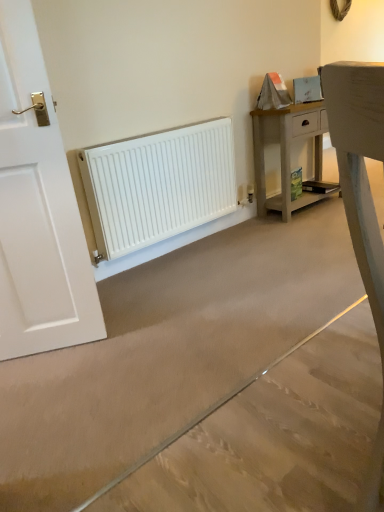
Question: Can you confirm if white matte radiator at lower left is positioned to the right of white matte radiator at center?

Choices:
 (A) yes
 (B) no

Answer: (B)

Question: Can we say white matte radiator at lower left lies outside white matte radiator at center?

Choices:
 (A) no
 (B) yes

Answer: (B)

Question: Can you confirm if white matte radiator at lower left is wider than white matte radiator at center?

Choices:
 (A) no
 (B) yes

Answer: (A)

Question: Is the position of white matte radiator at lower left more distant than that of white matte radiator at center?

Choices:
 (A) no
 (B) yes

Answer: (B)

Question: Considering the relative sizes of white matte radiator at lower left and white matte radiator at center in the image provided, is white matte radiator at lower left shorter than white matte radiator at center?

Choices:
 (A) yes
 (B) no

Answer: (B)

Question: From a real-world perspective, relative to white matte radiator at lower left, is light wood nightstand at upper right vertically above or below?

Choices:
 (A) above
 (B) below

Answer: (B)

Question: From the image's perspective, is light wood nightstand at upper right positioned above or below white matte radiator at lower left?

Choices:
 (A) above
 (B) below

Answer: (A)

Question: Choose the correct answer: Is light wood nightstand at upper right inside white matte radiator at lower left or outside it?

Choices:
 (A) outside
 (B) inside

Answer: (A)

Question: Is point (278, 124) positioned closer to the camera than point (97, 183)?

Choices:
 (A) farther
 (B) closer

Answer: (A)

Question: Is white matte radiator at lower left in front of or behind light wood nightstand at upper right in the image?

Choices:
 (A) front
 (B) behind

Answer: (A)

Question: Is white matte radiator at lower left inside or outside of light wood nightstand at upper right?

Choices:
 (A) inside
 (B) outside

Answer: (B)

Question: Does point (100, 219) appear closer or farther from the camera than point (317, 185)?

Choices:
 (A) closer
 (B) farther

Answer: (A)

Question: From the image's perspective, relative to light wood nightstand at upper right, is white matte radiator at lower left above or below?

Choices:
 (A) below
 (B) above

Answer: (A)

Question: From the image's perspective, relative to white matte radiator at lower left, is white matte radiator at center above or below?

Choices:
 (A) below
 (B) above

Answer: (A)

Question: From a real-world perspective, is white matte radiator at center above or below white matte radiator at lower left?

Choices:
 (A) above
 (B) below

Answer: (B)